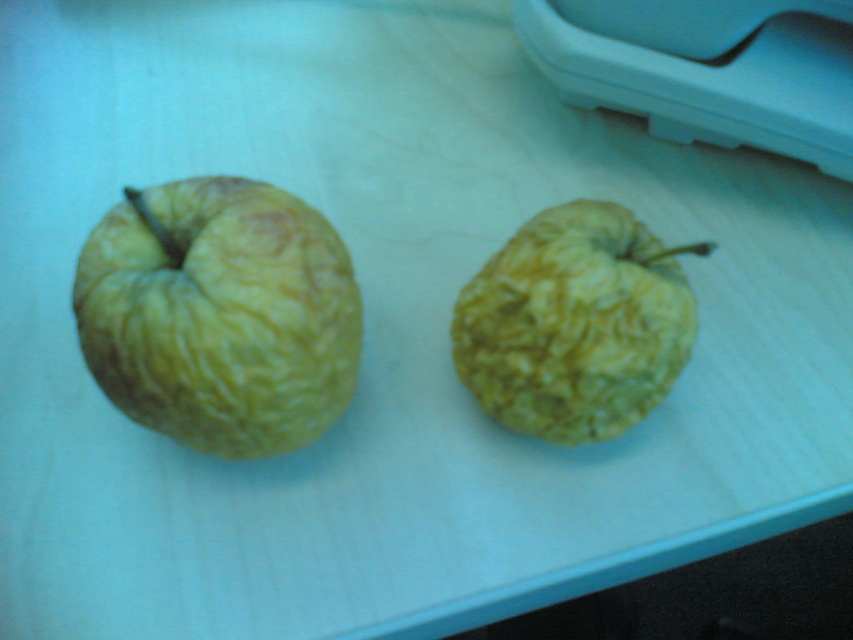
From the picture: You are arranging fruits on a table and see the yellow wrinkled apple at left and the yellow wrinkled apple at center. Which apple is placed higher up on the table?

The yellow wrinkled apple at left is positioned over the yellow wrinkled apple at center, so it is placed higher up on the table.

You are organizing items on a desk and see the yellow wrinkled apple at center and the blue plastic printer at upper right. Which object is closer to the left edge of the desk?

The yellow wrinkled apple at center is positioned on the left side of the blue plastic printer at upper right, so it is closer to the left edge of the desk.

You are a fruit inspector and need to determine if the two apples are within the required spacing of 10 inches apart for proper inspection. Are the yellow wrinkled apple at left and the yellow wrinkled apple at center spaced appropriately?

The distance between the yellow wrinkled apple at left and the yellow wrinkled apple at center is 8.36 inches, which is less than the required 10 inches. Therefore, they are not spaced appropriately for proper inspection.